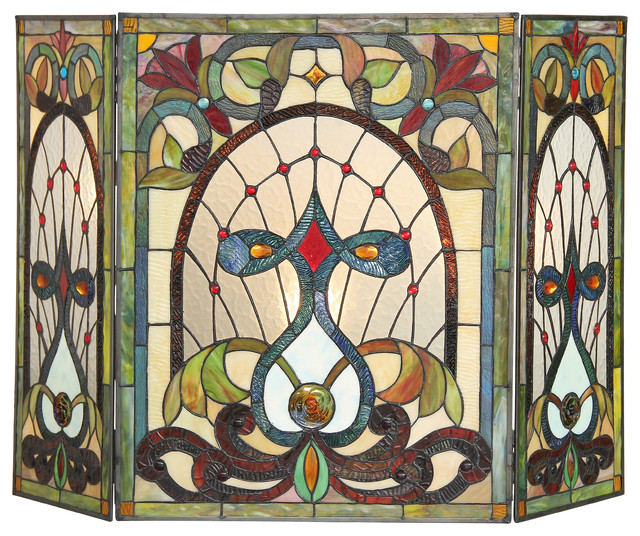
At what (x,y) coordinates should I click in order to perform the action: click on hinge. Please return your answer as a coordinate pair (x, y). The width and height of the screenshot is (640, 536). Looking at the image, I should click on (116, 57), (113, 457), (113, 360), (113, 274), (116, 174), (520, 56), (513, 456), (516, 102).